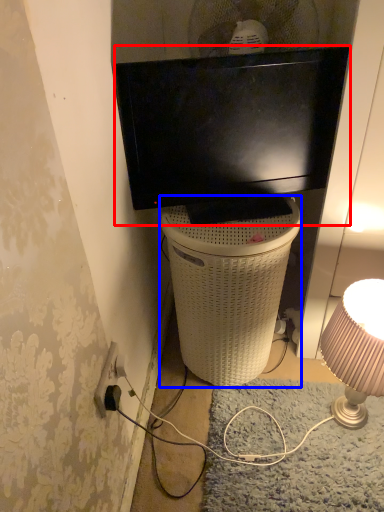
Question: Among these objects, which one is farthest to the camera, television (highlighted by a red box) or trash bin/can (highlighted by a blue box)?

Choices:
 (A) television
 (B) trash bin/can

Answer: (B)